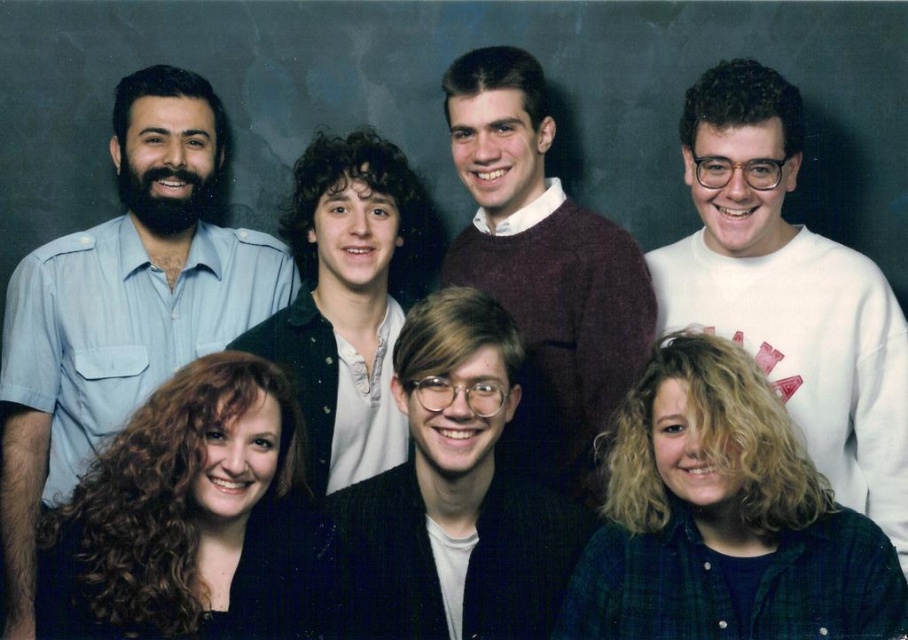
The height and width of the screenshot is (640, 908). Describe the element at coordinates (455, 493) in the screenshot. I see `dark brown textured blazer at center` at that location.

Does dark brown textured blazer at center have a lesser width compared to maroon sweater at center?

In fact, dark brown textured blazer at center might be wider than maroon sweater at center.

Measure the distance between point (482,317) and camera.

Point (482,317) is 1.52 meters away from camera.

Where is `dark brown textured blazer at center`? This screenshot has height=640, width=908. dark brown textured blazer at center is located at coordinates (455, 493).

Consider the image. Is white cotton sweatshirt at upper right taller than dark brown textured blazer at center?

Yes, white cotton sweatshirt at upper right is taller than dark brown textured blazer at center.

Is point (704, 170) farther from viewer compared to point (443, 310)?

That is True.

Where is `white cotton sweatshirt at upper right`? The height and width of the screenshot is (640, 908). white cotton sweatshirt at upper right is located at coordinates (788, 291).

In the scene shown: Is light blue shirt at left wider than white cotton sweatshirt at upper right?

Indeed, light blue shirt at left has a greater width compared to white cotton sweatshirt at upper right.

Looking at this image, can you confirm if light blue shirt at left is taller than white cotton sweatshirt at upper right?

Yes.

Measure the distance between point [235,269] and camera.

They are 2.18 meters apart.

Where is `light blue shirt at left`? light blue shirt at left is located at coordinates (122, 305).